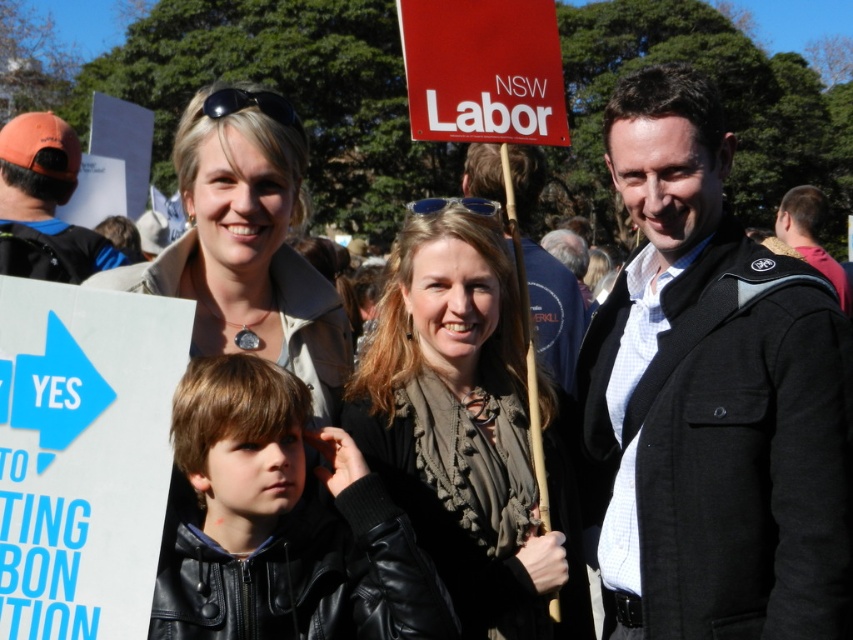
Can you confirm if orange fabric cap at left is thinner than dark brown leather jacket at right?

Indeed, orange fabric cap at left has a lesser width compared to dark brown leather jacket at right.

Can you confirm if orange fabric cap at left is smaller than dark brown leather jacket at right?

Indeed, orange fabric cap at left has a smaller size compared to dark brown leather jacket at right.

Between point (67, 256) and point (799, 224), which one is positioned behind?

Positioned behind is point (799, 224).

What are the coordinates of `orange fabric cap at left` in the screenshot? It's located at (44, 202).

Is orange fabric cap at left smaller than matte black jacket at right?

Correct, orange fabric cap at left occupies less space than matte black jacket at right.

Can you confirm if orange fabric cap at left is shorter than matte black jacket at right?

Yes.

The image size is (853, 640). What do you see at coordinates (44, 202) in the screenshot? I see `orange fabric cap at left` at bounding box center [44, 202].

What are the coordinates of `orange fabric cap at left` in the screenshot? It's located at (44, 202).

How far apart are black leather jacket at center and light beige coat at center?

22.89 inches

Can you confirm if black leather jacket at center is shorter than light beige coat at center?

Yes.

Does point (227, 385) come in front of point (169, 266)?

Yes, point (227, 385) is closer to viewer.

Image resolution: width=853 pixels, height=640 pixels. What are the coordinates of `black leather jacket at center` in the screenshot? It's located at (281, 524).